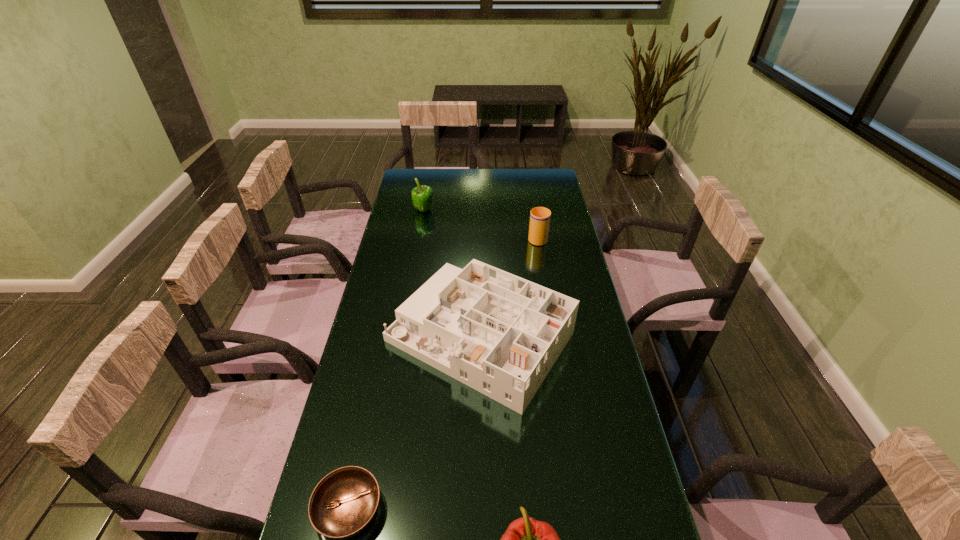
What are the coordinates of `dollhouse at the left edge` in the screenshot? It's located at click(x=500, y=334).

The height and width of the screenshot is (540, 960). Identify the location of dollhouse that is at the right edge. (500, 334).

You are a GUI agent. You are given a task and a screenshot of the screen. Output one action in this format:
    pyautogui.click(x=<x>, y=<y>)
    Task: Click on the cup at the right edge
    The image size is (960, 540).
    Given the screenshot: What is the action you would take?
    pyautogui.click(x=540, y=217)

Find the location of a particular element. free space at the far edge of the desktop is located at coordinates (479, 183).

You are a GUI agent. You are given a task and a screenshot of the screen. Output one action in this format:
    pyautogui.click(x=<x>, y=<y>)
    Task: Click on the blank area at the left edge
    
    Given the screenshot: What is the action you would take?
    pyautogui.click(x=372, y=356)

I want to click on vacant space at the right edge of the desktop, so click(x=529, y=197).

Image resolution: width=960 pixels, height=540 pixels. In the image, there is a desktop. What are the coordinates of `blank space at the far right corner` in the screenshot? It's located at (543, 183).

The image size is (960, 540). What are the coordinates of `free area in between the cup and the left bell pepper` in the screenshot? It's located at (481, 224).

Locate an element on the screen. free space between the fourth nearest object and the taller bell pepper is located at coordinates tap(481, 224).

Image resolution: width=960 pixels, height=540 pixels. In order to click on free spot between the second farthest object and the farthest object in this screenshot , I will do `click(481, 224)`.